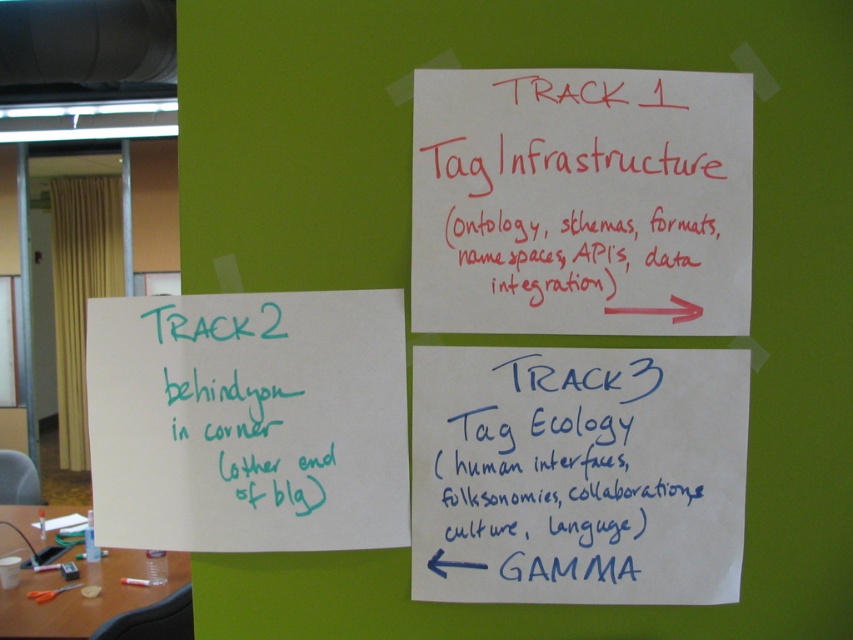
Question: Is white paper at upper center further to camera compared to blue handwritten paper at lower right?

Choices:
 (A) no
 (B) yes

Answer: (A)

Question: Which point appears closest to the camera in this image?

Choices:
 (A) (134, 444)
 (B) (444, 592)

Answer: (A)

Question: Where is white paper at upper center located in relation to green handwritten note at lower left in the image?

Choices:
 (A) left
 (B) right

Answer: (B)

Question: In this image, where is white paper at upper center located relative to green handwritten note at lower left?

Choices:
 (A) left
 (B) right

Answer: (B)

Question: Which point is closer to the camera taking this photo?

Choices:
 (A) (157, 330)
 (B) (537, 480)
 (C) (724, 81)

Answer: (A)

Question: Based on their relative distances, which object is nearer to the green handwritten note at lower left?

Choices:
 (A) white paper at upper center
 (B) blue handwritten paper at lower right

Answer: (B)